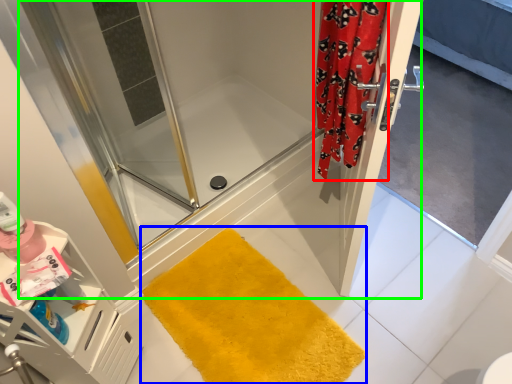
Question: Estimate the real-world distances between objects in this image. Which object is closer to shower curtain (highlighted by a red box), bath mat (highlighted by a blue box) or shower door (highlighted by a green box)?

Choices:
 (A) bath mat
 (B) shower door

Answer: (B)